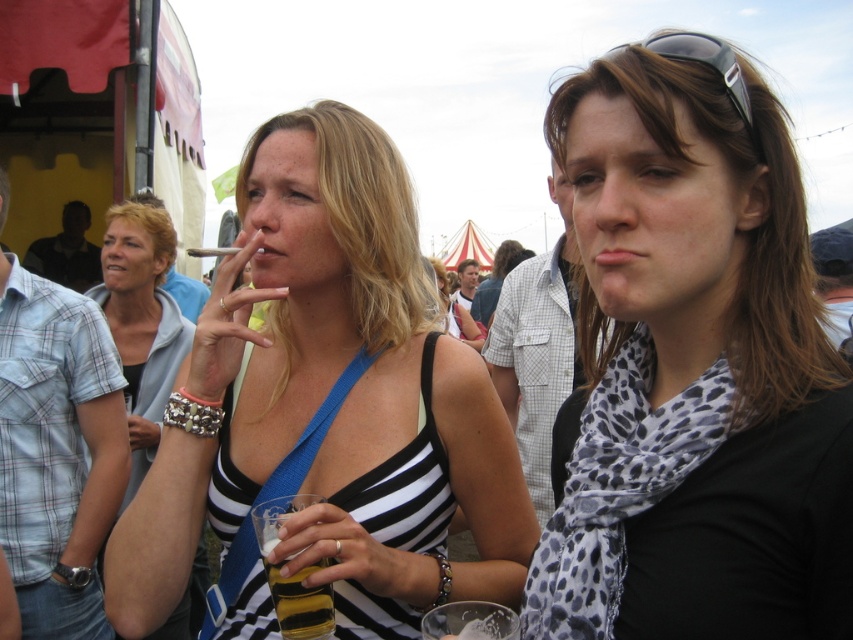
Who is positioned more to the right, translucent yellow liquid at lower center or black plastic sunglasses at upper right?

black plastic sunglasses at upper right is more to the right.

Which is above, translucent yellow liquid at lower center or black plastic sunglasses at upper right?

black plastic sunglasses at upper right

Who is more forward, (306, 616) or (693, 45)?

Point (693, 45) is more forward.

Where is `translucent yellow liquid at lower center`? This screenshot has width=853, height=640. translucent yellow liquid at lower center is located at coordinates (299, 600).

Can you confirm if leopard print scarf at center is positioned below black plastic sunglasses at upper right?

Yes, leopard print scarf at center is below black plastic sunglasses at upper right.

Is point (715, 147) in front of point (714, 45)?

No, it is behind (714, 45).

I want to click on leopard print scarf at center, so click(694, 368).

Image resolution: width=853 pixels, height=640 pixels. I want to click on leopard print scarf at center, so click(x=694, y=368).

Can you confirm if blonde hair at center is positioned to the left of black plastic sunglasses at upper right?

Yes, blonde hair at center is to the left of black plastic sunglasses at upper right.

Which is in front, point (90, 291) or point (746, 99)?

Positioned in front is point (746, 99).

Where is `blonde hair at center`? The image size is (853, 640). blonde hair at center is located at coordinates (141, 321).